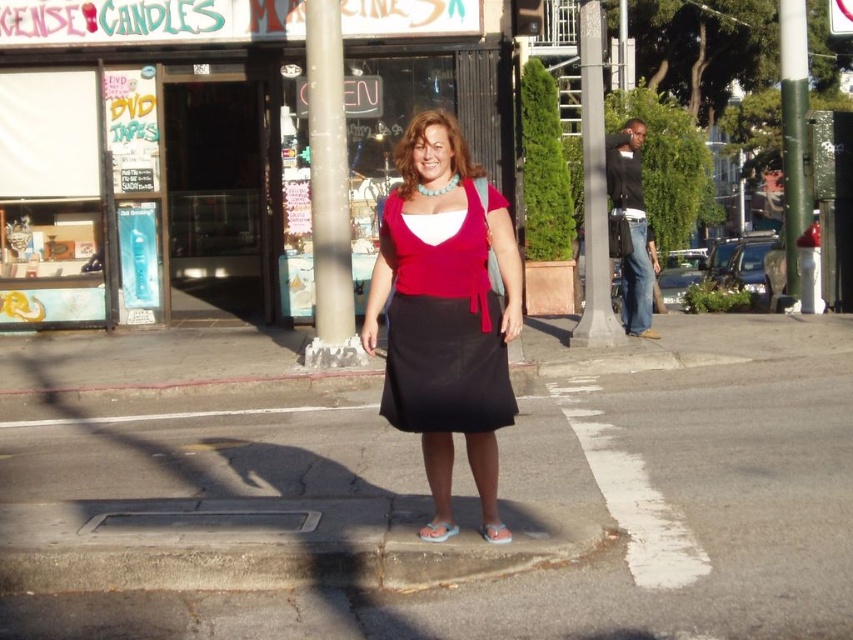
Measure the distance from black asphalt at center to matte red dress at center.

A distance of 2.26 meters exists between black asphalt at center and matte red dress at center.

Is point (236, 616) closer to viewer compared to point (416, 300)?

Yes, point (236, 616) is closer to viewer.

Does point (161, 464) come behind point (450, 356)?

Yes, point (161, 464) is farther from viewer.

The image size is (853, 640). I want to click on black asphalt at center, so click(x=454, y=502).

Which is behind, point (461, 285) or point (412, 289)?

Positioned behind is point (412, 289).

Is matte red blouse at center to the right of matte red dress at center from the viewer's perspective?

In fact, matte red blouse at center is to the left of matte red dress at center.

The image size is (853, 640). Identify the location of matte red blouse at center. (445, 314).

Does black asphalt at center appear on the right side of matte red blouse at center?

Indeed, black asphalt at center is positioned on the right side of matte red blouse at center.

Does black asphalt at center have a greater height compared to matte red blouse at center?

No.

The image size is (853, 640). Identify the location of black asphalt at center. (454, 502).

This screenshot has width=853, height=640. In order to click on black asphalt at center in this screenshot , I will do `click(454, 502)`.